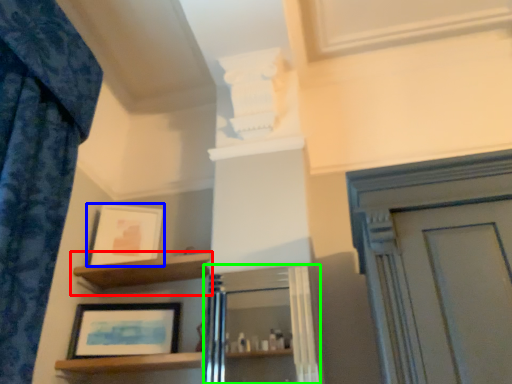
Question: Which is nearer to the shelf (highlighted by a red box)? picture frame (highlighted by a blue box) or cabinetry (highlighted by a green box).

Choices:
 (A) picture frame
 (B) cabinetry

Answer: (A)